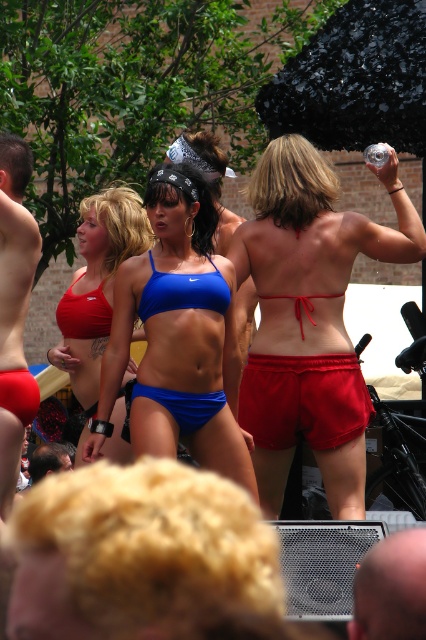
Who is more distant from viewer, [321,356] or [14,422]?

The point [14,422] is more distant.

Can you confirm if red fabric shorts at center is positioned below matte red shorts at left?

Correct, red fabric shorts at center is located below matte red shorts at left.

Is point (333, 413) less distant than point (2, 356)?

Yes.

I want to click on red fabric shorts at center, so click(304, 401).

Between point (265, 220) and point (288, 397), which one is positioned behind?

Positioned behind is point (265, 220).

Where is `red satin shorts at upper center`? The image size is (426, 640). red satin shorts at upper center is located at coordinates (310, 317).

Which is behind, point (9, 404) or point (86, 294)?

Point (86, 294)

Does matte red shorts at left have a greater height compared to matte red bikini top at left?

Yes.

Which is behind, point (17, 228) or point (66, 333)?

The point (66, 333) is more distant.

Where is `matte red shorts at left`? The image size is (426, 640). matte red shorts at left is located at coordinates (14, 307).